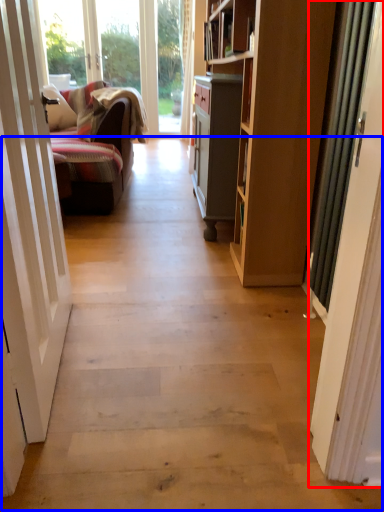
Question: Among these objects, which one is farthest to the camera, door (highlighted by a red box) or path (highlighted by a blue box)?

Choices:
 (A) door
 (B) path

Answer: (A)